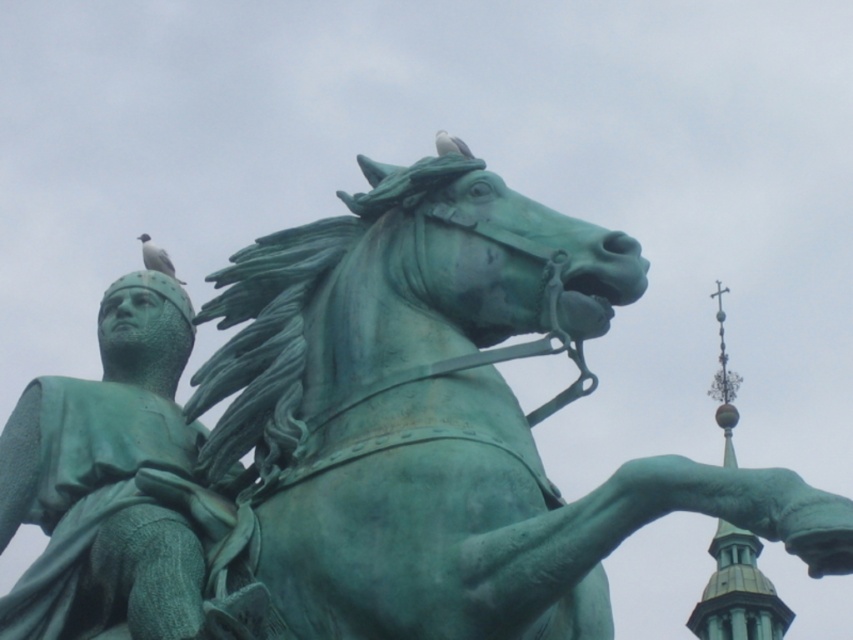
Question: Is the position of green patinated metal horse at center less distant than that of green copper tower at upper right?

Choices:
 (A) yes
 (B) no

Answer: (A)

Question: Which of these objects is positioned farthest from the white matte bird at upper left?

Choices:
 (A) green copper tower at upper right
 (B) green patinated metal horse at center

Answer: (A)

Question: Which object is positioned farthest from the green patinated metal horse at center?

Choices:
 (A) green copper tower at upper right
 (B) white matte bird at upper left

Answer: (A)

Question: Is green patinated bronze statue at left positioned at the back of white matte bird at upper left?

Choices:
 (A) yes
 (B) no

Answer: (B)

Question: Is green patinated metal horse at center thinner than white matte bird at upper left?

Choices:
 (A) no
 (B) yes

Answer: (A)

Question: Based on their relative distances, which object is farther from the white matte bird at upper left?

Choices:
 (A) green patinated bronze statue at left
 (B) green copper tower at upper right

Answer: (B)